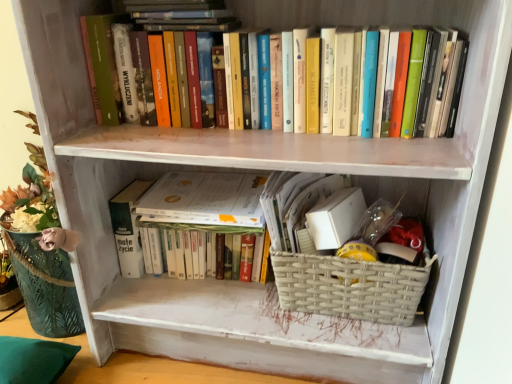
Question: Is hardcover books at upper center, which ranks as the first book in top-to-bottom order, facing away from woven beige basket at lower center?

Choices:
 (A) yes
 (B) no

Answer: (B)

Question: Does hardcover books at upper center, which is the 2th book from bottom to top, have a greater height compared to woven beige basket at lower center?

Choices:
 (A) yes
 (B) no

Answer: (A)

Question: Is the position of hardcover books at upper center, which ranks as the first book in top-to-bottom order, less distant than that of woven beige basket at lower center?

Choices:
 (A) yes
 (B) no

Answer: (A)

Question: Is hardcover books at upper center, which is the 2th book from bottom to top, oriented towards woven beige basket at lower center?

Choices:
 (A) no
 (B) yes

Answer: (A)

Question: Considering the relative sizes of hardcover books at upper center, which is the 2th book from bottom to top, and woven beige basket at lower center in the image provided, is hardcover books at upper center, which is the 2th book from bottom to top, shorter than woven beige basket at lower center?

Choices:
 (A) no
 (B) yes

Answer: (A)

Question: From the image's perspective, is hardcover books at upper center, which is the 2th book from bottom to top, located above or below white paper at center?

Choices:
 (A) below
 (B) above

Answer: (B)

Question: From a real-world perspective, is hardcover books at upper center, which is the 2th book from bottom to top, above or below white paper at center?

Choices:
 (A) above
 (B) below

Answer: (A)

Question: Considering the positions of hardcover books at upper center, which is the 2th book from bottom to top, and white paper at center in the image, is hardcover books at upper center, which is the 2th book from bottom to top, bigger or smaller than white paper at center?

Choices:
 (A) small
 (B) big

Answer: (B)

Question: In terms of height, does hardcover books at upper center, which is the 2th book from bottom to top, look taller or shorter compared to white paper at center?

Choices:
 (A) short
 (B) tall

Answer: (B)

Question: In terms of height, does hardcover books at upper center, which is the 2th book from bottom to top, look taller or shorter compared to hardcover book at center, the 1th book in the bottom-to-top sequence?

Choices:
 (A) tall
 (B) short

Answer: (A)

Question: Based on their positions, is hardcover books at upper center, which is the 2th book from bottom to top, located to the left or right of hardcover book at center, the second book when ordered from top to bottom?

Choices:
 (A) right
 (B) left

Answer: (A)

Question: From the image's perspective, is hardcover books at upper center, which ranks as the first book in top-to-bottom order, above or below hardcover book at center, the second book when ordered from top to bottom?

Choices:
 (A) above
 (B) below

Answer: (A)

Question: Do you think hardcover books at upper center, which ranks as the first book in top-to-bottom order, is within hardcover book at center, the 1th book in the bottom-to-top sequence, or outside of it?

Choices:
 (A) outside
 (B) inside

Answer: (A)

Question: From a real-world perspective, relative to woven beige basket at lower center, is hardcover books at upper center, which is the 2th book from bottom to top, vertically above or below?

Choices:
 (A) above
 (B) below

Answer: (A)

Question: Is point (315, 21) positioned closer to the camera than point (312, 297)?

Choices:
 (A) closer
 (B) farther

Answer: (A)